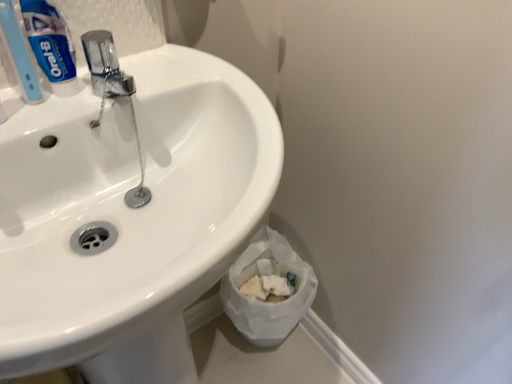
Question: Is white glossy sink at upper left wider or thinner than light blue plastic toothbrush at upper left?

Choices:
 (A) thin
 (B) wide

Answer: (B)

Question: Is white glossy sink at upper left inside the boundaries of light blue plastic toothbrush at upper left, or outside?

Choices:
 (A) inside
 (B) outside

Answer: (B)

Question: Considering the real-world distances, which object is closest to the light blue plastic toothbrush at upper left?

Choices:
 (A) white glossy sink at upper left
 (B) white crumpled paper at lower right
 (C) blue glossy toothpaste at upper left

Answer: (C)

Question: Based on their relative distances, which object is nearer to the blue glossy toothpaste at upper left?

Choices:
 (A) white crumpled paper at lower right
 (B) white glossy sink at upper left
 (C) light blue plastic toothbrush at upper left

Answer: (C)